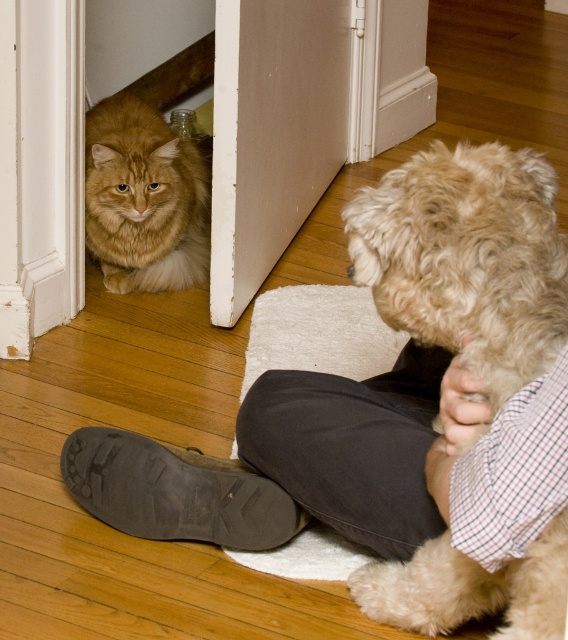
Question: Estimate the real-world distances between objects in this image. Which object is farther from the brown suede shoe at lower center?

Choices:
 (A) fluffy beige dog at lower right
 (B) golden fur cat at lower left

Answer: (B)

Question: Which object is farther from the camera taking this photo?

Choices:
 (A) golden fur cat at lower left
 (B) fluffy beige dog at lower right
 (C) brown suede shoe at lower center

Answer: (A)

Question: Is golden fur cat at lower left to the left of brown suede shoe at lower center from the viewer's perspective?

Choices:
 (A) yes
 (B) no

Answer: (A)

Question: Does golden fur cat at lower left have a lesser width compared to brown suede shoe at lower center?

Choices:
 (A) no
 (B) yes

Answer: (B)

Question: Which point is closer to the camera taking this photo?

Choices:
 (A) (116, 522)
 (B) (391, 570)

Answer: (B)

Question: Where is fluffy beige dog at lower right located in relation to brown suede shoe at lower center in the image?

Choices:
 (A) below
 (B) above

Answer: (B)